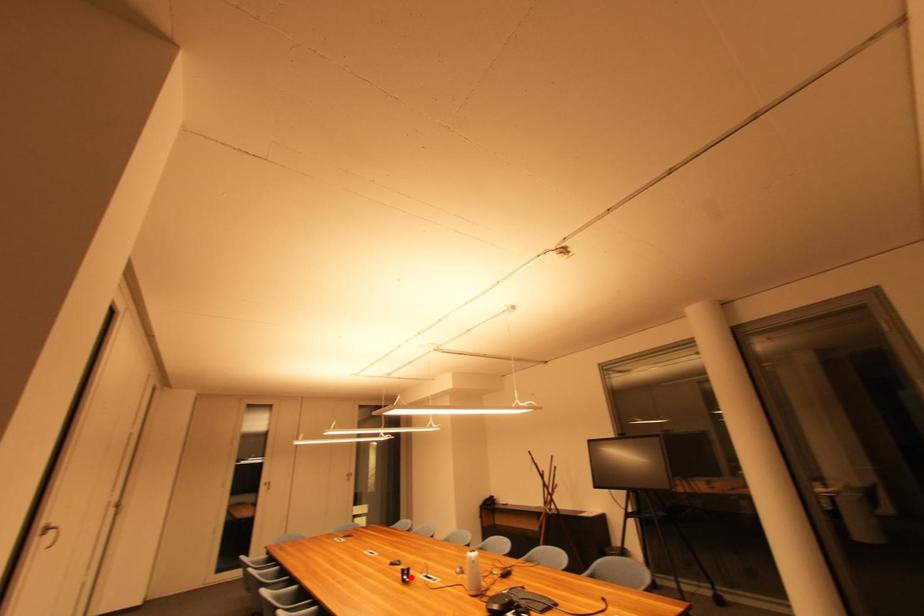
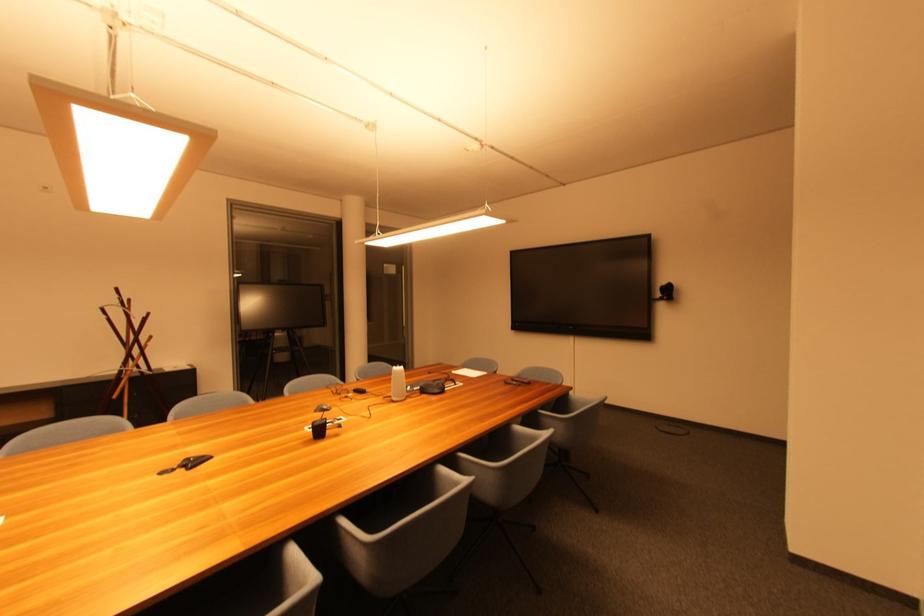
The point at the highlighted location is marked in the first image. Where is the corresponding point in the second image?

(324, 432)